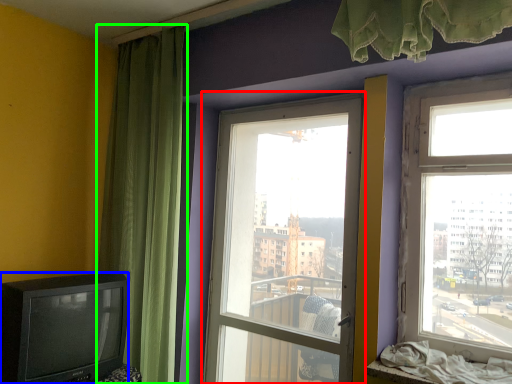
Question: Considering the real-world distances, which object is farthest from window (highlighted by a red box)? television (highlighted by a blue box) or curtain (highlighted by a green box)?

Choices:
 (A) television
 (B) curtain

Answer: (A)